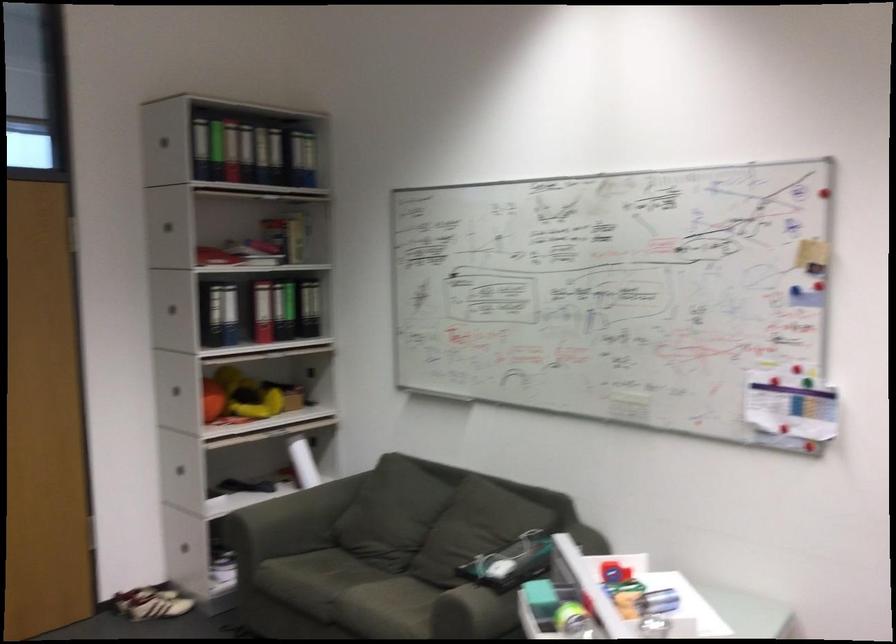
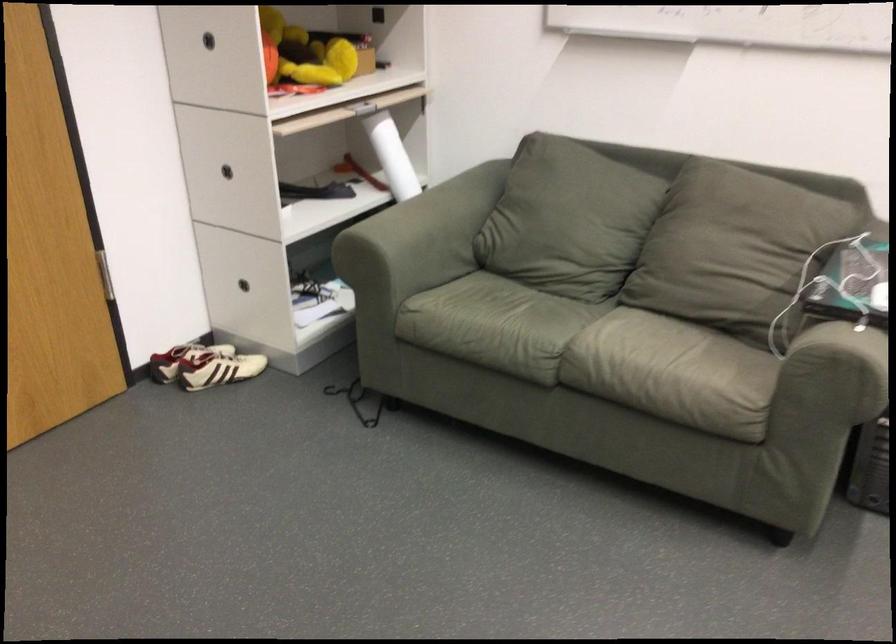
In the second image, find the point that corresponds to point (375, 534) in the first image.

(558, 232)